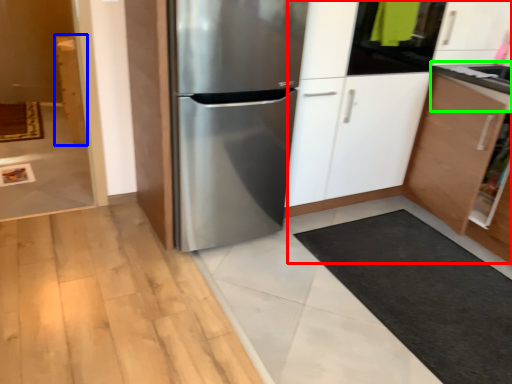
Question: Estimate the real-world distances between objects in this image. Which object is farther from dresser (highlighted by a red box), cabinetry (highlighted by a blue box) or counter top (highlighted by a green box)?

Choices:
 (A) cabinetry
 (B) counter top

Answer: (A)